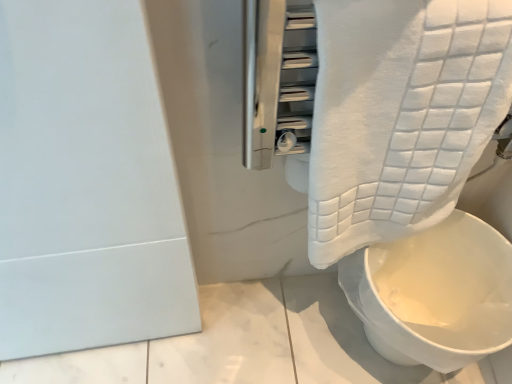
Image resolution: width=512 pixels, height=384 pixels. I want to click on free region under white fabric toilet at lower right (from a real-world perspective), so click(366, 344).